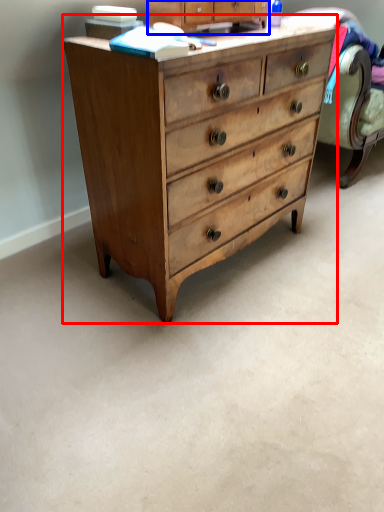
Question: Among these objects, which one is nearest to the camera, chest of drawers (highlighted by a red box) or cabinetry (highlighted by a blue box)?

Choices:
 (A) chest of drawers
 (B) cabinetry

Answer: (A)